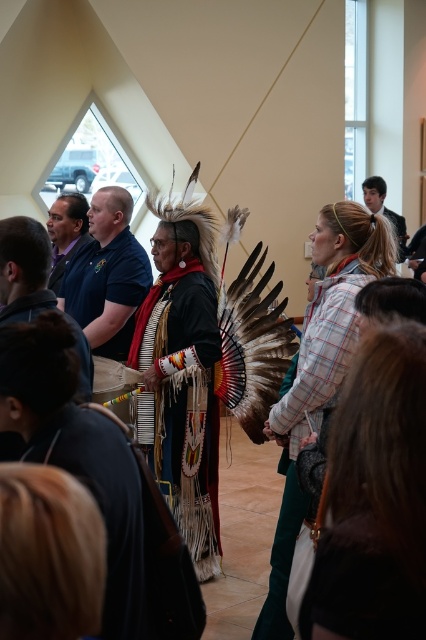
Question: Considering the real-world distances, which object is closest to the plush brown feather headdress at center?

Choices:
 (A) leather fringe headdress at center
 (B) dark blue shirt at center
 (C) matte black shirt at left
 (D) matte black shirt at upper right

Answer: (A)

Question: Does dark blue shirt at center appear over plush brown fur vest at center?

Choices:
 (A) yes
 (B) no

Answer: (B)

Question: Which object is positioned closest to the plush brown fur vest at center?

Choices:
 (A) matte black shirt at left
 (B) plush brown feather headdress at center
 (C) leather fringe headdress at center

Answer: (A)

Question: Which point appears farthest from the camera in this image?

Choices:
 (A) (270, 592)
 (B) (164, 438)

Answer: (B)

Question: In this image, where is plush brown feather headdress at center located relative to matte black shirt at upper right?

Choices:
 (A) left
 (B) right

Answer: (A)

Question: Is dark blue shirt at center positioned before plush brown feather headdress at center?

Choices:
 (A) yes
 (B) no

Answer: (B)